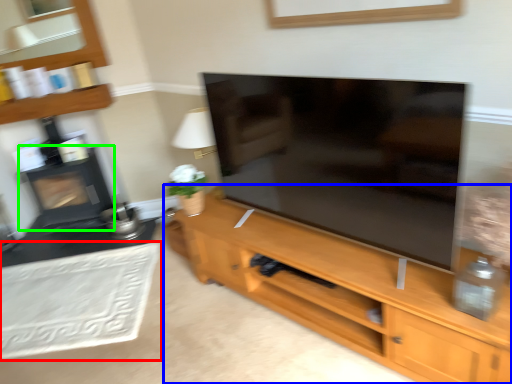
Question: Based on their relative distances, which object is farther from plain (highlighted by a red box)? Choose from cupboard (highlighted by a blue box) and fireplace (highlighted by a green box).

Choices:
 (A) cupboard
 (B) fireplace

Answer: (A)